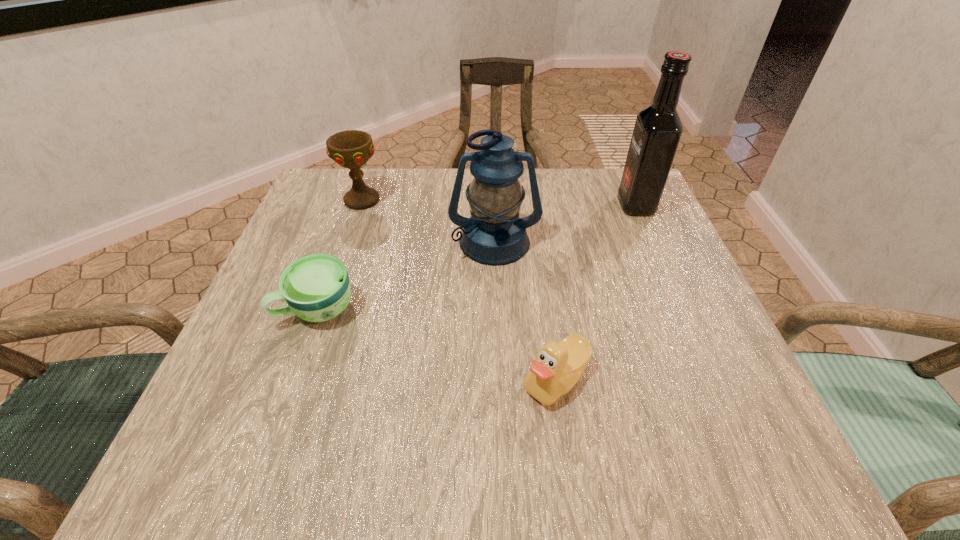
This screenshot has height=540, width=960. I want to click on the tallest object, so click(658, 128).

You are a GUI agent. You are given a task and a screenshot of the screen. Output one action in this format:
    pyautogui.click(x=<x>, y=<y>)
    Task: Click on the rightmost object
    The width and height of the screenshot is (960, 540).
    Given the screenshot: What is the action you would take?
    click(x=658, y=128)

The height and width of the screenshot is (540, 960). What are the coordinates of `the third farthest object` in the screenshot? It's located at (494, 235).

You are a GUI agent. You are given a task and a screenshot of the screen. Output one action in this format:
    pyautogui.click(x=<x>, y=<y>)
    Task: Click on the lantern
    The image size is (960, 540).
    Given the screenshot: What is the action you would take?
    pyautogui.click(x=494, y=235)

In order to click on chalice in this screenshot , I will do `click(351, 149)`.

Locate an element on the screen. Image resolution: width=960 pixels, height=540 pixels. duck is located at coordinates click(x=557, y=367).

The image size is (960, 540). I want to click on the fourth tallest object, so click(x=557, y=367).

You are a GUI agent. You are given a task and a screenshot of the screen. Output one action in this format:
    pyautogui.click(x=<x>, y=<y>)
    Task: Click on the shortest object
    This screenshot has width=960, height=540.
    Given the screenshot: What is the action you would take?
    (x=316, y=288)

You are a GUI agent. You are given a task and a screenshot of the screen. Output one action in this format:
    pyautogui.click(x=<x>, y=<y>)
    Task: Click on the cup
    The width and height of the screenshot is (960, 540).
    Given the screenshot: What is the action you would take?
    tap(316, 288)

Find the location of a particular element. The width and height of the screenshot is (960, 540). vacant space located 0.220m on the front-facing side of the liquor is located at coordinates (525, 205).